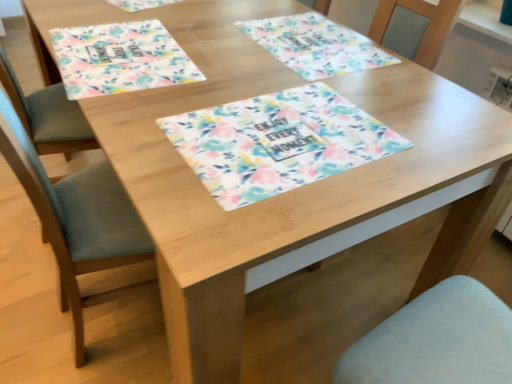
Where is `unoccupied space behind floral fabric placemat at center`? Image resolution: width=512 pixels, height=384 pixels. unoccupied space behind floral fabric placemat at center is located at coordinates (279, 62).